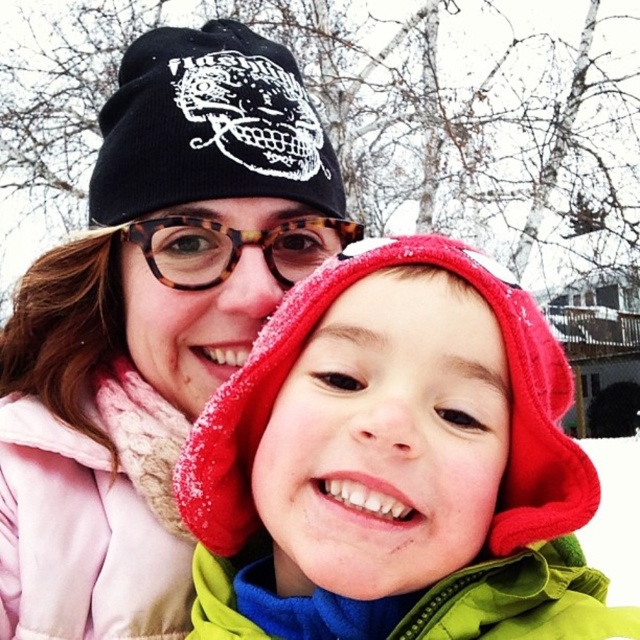
Does matte black beanie at upper left appear on the left side of black knit beanie at upper left?

Correct, you'll find matte black beanie at upper left to the left of black knit beanie at upper left.

Which is above, matte black beanie at upper left or black knit beanie at upper left?

Positioned higher is black knit beanie at upper left.

The width and height of the screenshot is (640, 640). I want to click on matte black beanie at upper left, so click(x=150, y=324).

The image size is (640, 640). Find the location of `matte black beanie at upper left`. matte black beanie at upper left is located at coordinates (150, 324).

Between matte black beanie at upper left and tortoiseshell glasses at center, which one appears on the right side from the viewer's perspective?

tortoiseshell glasses at center is more to the right.

Does matte black beanie at upper left appear on the left side of tortoiseshell glasses at center?

Indeed, matte black beanie at upper left is positioned on the left side of tortoiseshell glasses at center.

This screenshot has width=640, height=640. In order to click on matte black beanie at upper left in this screenshot , I will do `click(150, 324)`.

In the scene shown: Is fuzzy fleece hood at center thinner than matte black beanie at upper left?

Indeed, fuzzy fleece hood at center has a lesser width compared to matte black beanie at upper left.

From the picture: Who is lower down, fuzzy fleece hood at center or matte black beanie at upper left?

fuzzy fleece hood at center is lower down.

Who is more distant from viewer, (516,396) or (74,509)?

The point (74,509) is more distant.

Locate an element on the screen. This screenshot has width=640, height=640. fuzzy fleece hood at center is located at coordinates (396, 464).